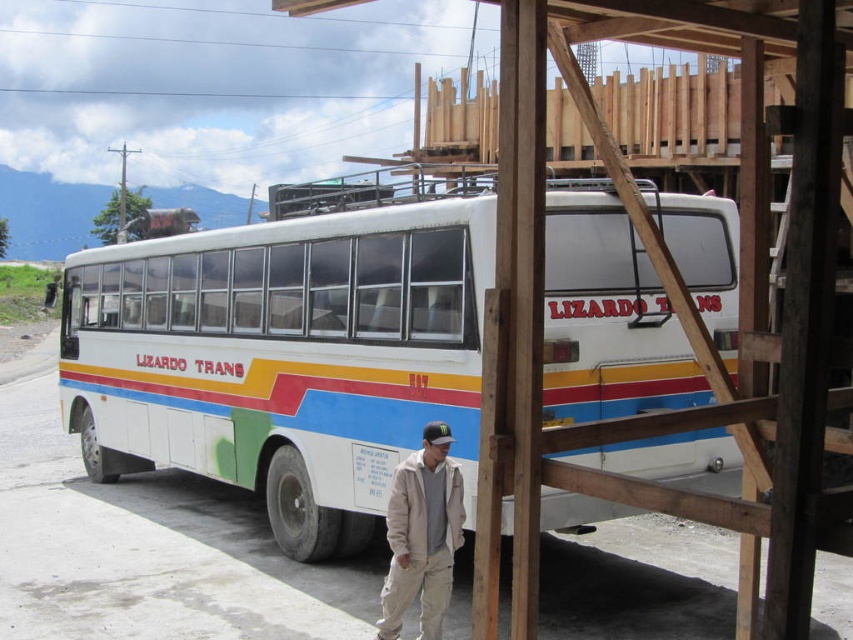
Which is in front, point (207, 384) or point (401, 465)?

Point (401, 465) is in front.

Is white matte bus at center positioned at the back of khaki cotton pants at lower center?

That is True.

This screenshot has width=853, height=640. Identify the location of white matte bus at center. (285, 355).